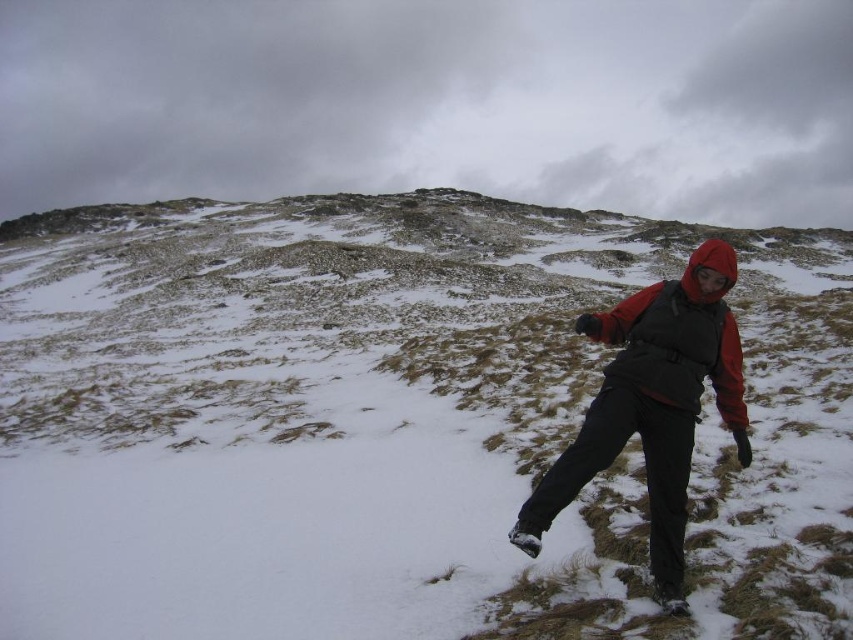
Question: Which point is closer to the camera?

Choices:
 (A) matte black jacket at center
 (B) white powdery snow at center

Answer: (B)

Question: Does matte black jacket at center appear on the right side of red fleece jacket at right?

Choices:
 (A) yes
 (B) no

Answer: (A)

Question: Is the position of white powdery snow at center less distant than that of red fleece jacket at right?

Choices:
 (A) no
 (B) yes

Answer: (B)

Question: Which point is closer to the camera?

Choices:
 (A) (607, 333)
 (B) (701, 346)

Answer: (B)

Question: Considering the relative positions of white powdery snow at center and matte black jacket at center in the image provided, where is white powdery snow at center located with respect to matte black jacket at center?

Choices:
 (A) left
 (B) right

Answer: (A)

Question: Which point is farther to the camera?

Choices:
 (A) matte black jacket at center
 (B) red fleece jacket at right

Answer: (B)